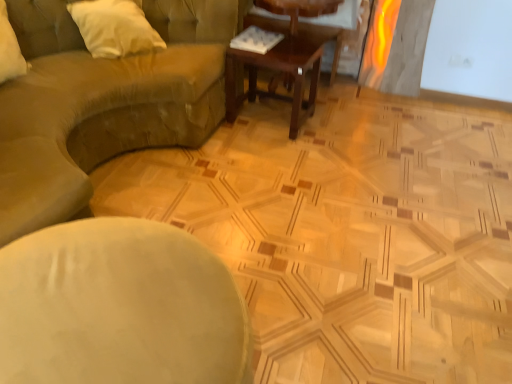
The height and width of the screenshot is (384, 512). I want to click on wooden coffee table at center, so click(278, 67).

Find the location of `white soft pillow at upper left`. white soft pillow at upper left is located at coordinates (114, 28).

Describe the element at coordinates (298, 9) in the screenshot. I see `wooden cocktail table at center` at that location.

Image resolution: width=512 pixels, height=384 pixels. Describe the element at coordinates (119, 307) in the screenshot. I see `smooth green cushion at center` at that location.

What are the coordinates of `wooden coffee table at center` in the screenshot? It's located at (278, 67).

Looking at this image, considering the relative positions of white soft pillow at upper left and suede-like beige couch at upper left in the image provided, is white soft pillow at upper left to the right of suede-like beige couch at upper left from the viewer's perspective?

Indeed, white soft pillow at upper left is positioned on the right side of suede-like beige couch at upper left.

In terms of height, does white soft pillow at upper left look taller or shorter compared to suede-like beige couch at upper left?

In the image, white soft pillow at upper left appears to be shorter than suede-like beige couch at upper left.

Considering the positions of point (148, 47) and point (27, 59), is point (148, 47) closer or farther from the camera than point (27, 59)?

Clearly, point (148, 47) is more distant from the camera than point (27, 59).

Can you see white soft pillow at upper left touching wooden coffee table at center?

No, white soft pillow at upper left is not next to wooden coffee table at center.

How distant is white soft pillow at upper left from wooden coffee table at center?

26.43 inches.

Is white soft pillow at upper left aimed at wooden coffee table at center?

No, white soft pillow at upper left is not turned towards wooden coffee table at center.

Does wooden cocktail table at center contain smooth green cushion at center?

Actually, smooth green cushion at center is outside wooden cocktail table at center.

From the picture: Which is closer to the camera, (x=296, y=23) or (x=213, y=254)?

The point (x=213, y=254) is closer to the camera.

In the scene shown: Considering the sizes of objects wooden cocktail table at center and smooth green cushion at center in the image provided, who is shorter, wooden cocktail table at center or smooth green cushion at center?

Standing shorter between the two is smooth green cushion at center.

Is smooth green cushion at center not near wooden coffee table at center?

That's right, there is a large distance between smooth green cushion at center and wooden coffee table at center.

Is smooth green cushion at center facing towards wooden coffee table at center?

Yes, smooth green cushion at center faces towards wooden coffee table at center.

Measure the distance from smooth green cushion at center to wooden coffee table at center.

A distance of 1.55 meters exists between smooth green cushion at center and wooden coffee table at center.

From a real-world perspective, which object rests below the other?

From a 3D spatial view, smooth green cushion at center is below.

Is wooden coffee table at center to the left or to the right of white soft pillow at upper left in the image?

wooden coffee table at center is positioned on white soft pillow at upper left's right side.

Considering the relative sizes of wooden coffee table at center and white soft pillow at upper left in the image provided, is wooden coffee table at center thinner than white soft pillow at upper left?

No.

From the picture: Between wooden coffee table at center and white soft pillow at upper left, which one has less height?

white soft pillow at upper left.

Looking at this image, considering the positions of objects wooden coffee table at center and white soft pillow at upper left in the image provided, who is in front, wooden coffee table at center or white soft pillow at upper left?

Positioned in front is white soft pillow at upper left.

Would you say wooden coffee table at center is outside smooth green cushion at center?

Yes.

Is wooden coffee table at center aimed at smooth green cushion at center?

Yes.

Identify the location of coffee table lying behind the smooth green cushion at center. This screenshot has width=512, height=384. (278, 67).

Considering the relative sizes of wooden cocktail table at center and suede-like beige couch at upper left in the image provided, is wooden cocktail table at center smaller than suede-like beige couch at upper left?

Yes.

From the image's perspective, is wooden cocktail table at center located beneath suede-like beige couch at upper left?

No, from the image's perspective, wooden cocktail table at center is not beneath suede-like beige couch at upper left.

This screenshot has width=512, height=384. Identify the location of cocktail table behind the suede-like beige couch at upper left. (298, 9).

From a real-world perspective, is wooden cocktail table at center located higher than suede-like beige couch at upper left?

No, from a real-world perspective, wooden cocktail table at center is not above suede-like beige couch at upper left.

There is a suede-like beige couch at upper left. Where is `pillow above it (from a real-world perspective)`? The height and width of the screenshot is (384, 512). pillow above it (from a real-world perspective) is located at coordinates (114, 28).

I want to click on coffee table above the white soft pillow at upper left (from the image's perspective), so click(278, 67).

Based on their spatial positions, is white soft pillow at upper left or smooth green cushion at center closer to wooden cocktail table at center?

The object closer to wooden cocktail table at center is white soft pillow at upper left.

Estimate the real-world distances between objects in this image. Which object is closer to white soft pillow at upper left, suede-like beige couch at upper left or wooden coffee table at center?

suede-like beige couch at upper left is positioned closer to the anchor white soft pillow at upper left.

Estimate the real-world distances between objects in this image. Which object is closer to smooth green cushion at center, white soft pillow at upper left or wooden cocktail table at center?

Among the two, white soft pillow at upper left is located nearer to smooth green cushion at center.

When comparing their distances from smooth green cushion at center, does wooden coffee table at center or suede-like beige couch at upper left seem closer?

The object closer to smooth green cushion at center is suede-like beige couch at upper left.

Looking at the image, which one is located further to smooth green cushion at center, white soft pillow at upper left or wooden coffee table at center?

wooden coffee table at center is further to smooth green cushion at center.

Looking at the image, which one is located closer to wooden cocktail table at center, smooth green cushion at center or suede-like beige couch at upper left?

suede-like beige couch at upper left lies closer to wooden cocktail table at center than the other object.

Considering their positions, is white soft pillow at upper left positioned further to suede-like beige couch at upper left than smooth green cushion at center?

Based on the image, smooth green cushion at center appears to be further to suede-like beige couch at upper left.

Based on their spatial positions, is white soft pillow at upper left or wooden coffee table at center closer to wooden cocktail table at center?

Among the two, wooden coffee table at center is located nearer to wooden cocktail table at center.

Find the location of a particular element. Image resolution: width=512 pixels, height=384 pixels. coffee table between white soft pillow at upper left and wooden cocktail table at center from left to right is located at coordinates (278, 67).

Identify the location of pillow positioned between smooth green cushion at center and wooden cocktail table at center from near to far. (114, 28).

This screenshot has height=384, width=512. Identify the location of pillow between smooth green cushion at center and wooden coffee table at center along the z-axis. (114, 28).

Find the location of a particular element. The height and width of the screenshot is (384, 512). coffee table between suede-like beige couch at upper left and wooden cocktail table at center along the z-axis is located at coordinates (278, 67).